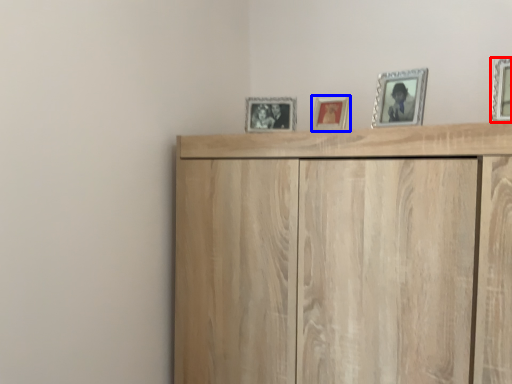
Question: Among these objects, which one is farthest to the camera, picture frame (highlighted by a red box) or picture frame (highlighted by a blue box)?

Choices:
 (A) picture frame
 (B) picture frame

Answer: (B)